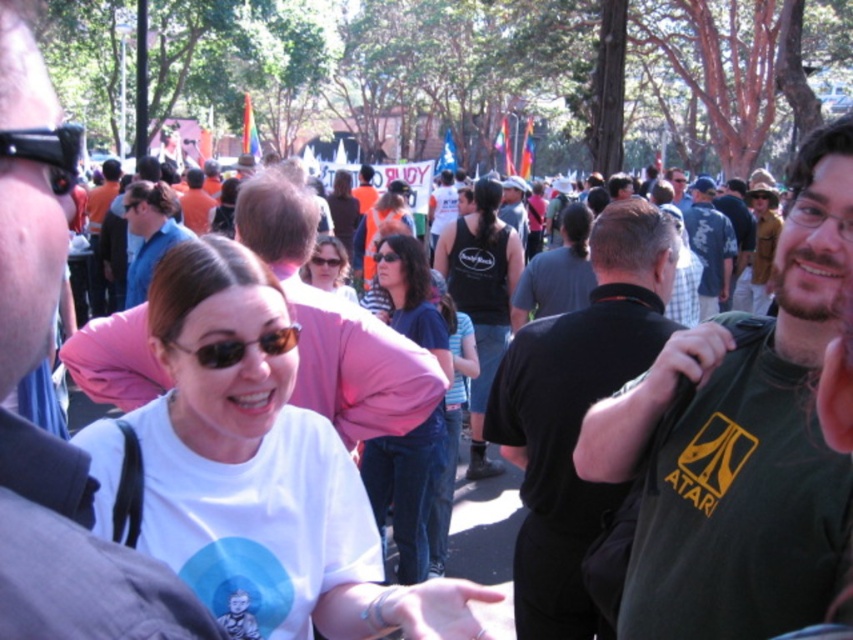
Question: Does dark blue jeans at center have a lesser width compared to black matte camera at upper left?

Choices:
 (A) no
 (B) yes

Answer: (B)

Question: Which of these objects is positioned farthest from the black matte camera at upper left?

Choices:
 (A) dark blue jeans at center
 (B) black matte shirt at center

Answer: (A)

Question: Which point is farther to the camera?

Choices:
 (A) black plastic sunglasses at center
 (B) white matte t-shirt at center
 (C) brown leather jacket at upper right
 (D) black matte camera at upper left

Answer: (C)

Question: Which of these objects is positioned closest to the matte white shirt at center?

Choices:
 (A) black tank top at center
 (B) white matte t-shirt at center
 (C) orange shirt at center

Answer: (C)

Question: Does dark blue shirt at center appear on the right side of matte white shirt at center?

Choices:
 (A) no
 (B) yes

Answer: (B)

Question: Is dark blue jeans at center above matte black sunglasses at center?

Choices:
 (A) no
 (B) yes

Answer: (B)